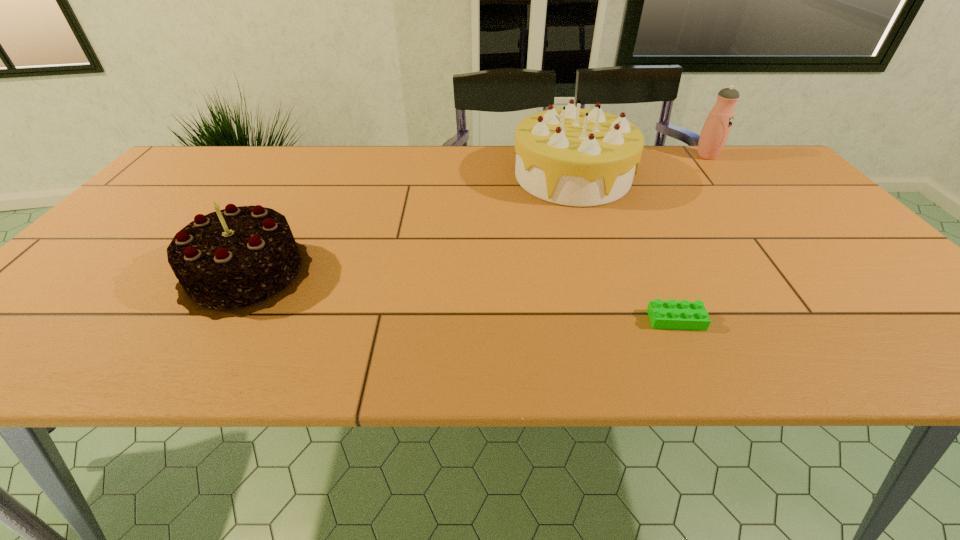
Where is `birthday cake situated at the far edge`? birthday cake situated at the far edge is located at coordinates (569, 156).

Image resolution: width=960 pixels, height=540 pixels. Find the location of `object located at the near edge`. object located at the near edge is located at coordinates (681, 315).

The width and height of the screenshot is (960, 540). I want to click on object present at the right edge, so click(x=716, y=129).

You are a GUI agent. You are given a task and a screenshot of the screen. Output one action in this format:
    pyautogui.click(x=<x>, y=<y>)
    Task: Click on the object positioned at the far right corner
    This screenshot has height=540, width=960.
    Given the screenshot: What is the action you would take?
    pyautogui.click(x=716, y=129)

Where is `vacant space at the far edge of the desktop`? The image size is (960, 540). vacant space at the far edge of the desktop is located at coordinates (684, 147).

Find the location of `vacant area at the near edge of the desktop`. vacant area at the near edge of the desktop is located at coordinates (709, 361).

Locate an element on the screen. The image size is (960, 540). blank space at the left edge of the desktop is located at coordinates (116, 266).

Identify the location of vacant region at the right edge. This screenshot has height=540, width=960. (804, 218).

The image size is (960, 540). Find the location of `free location at the far left corner of the desktop`. free location at the far left corner of the desktop is located at coordinates (215, 173).

The height and width of the screenshot is (540, 960). Find the location of `free space between the rightmost object and the Lego`. free space between the rightmost object and the Lego is located at coordinates (691, 238).